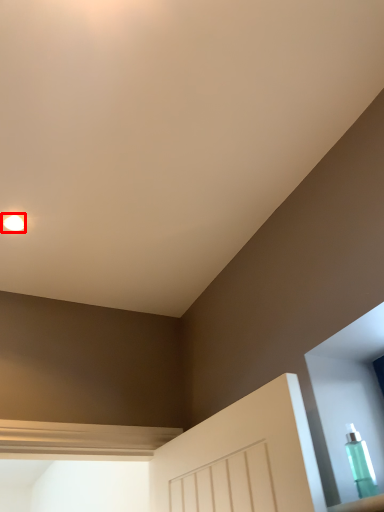
Question: Considering the relative positions of droplight (annotated by the red box) and bottle in the image provided, where is droplight (annotated by the red box) located with respect to the staircase?

Choices:
 (A) left
 (B) right

Answer: (A)